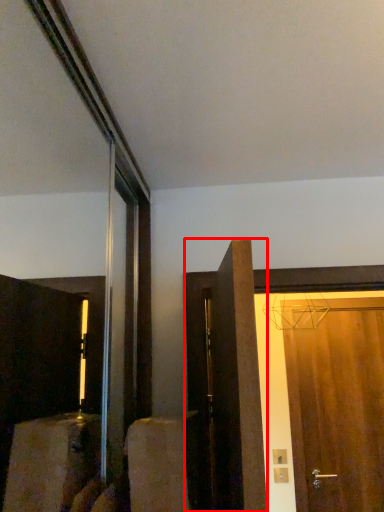
Question: From the image's perspective, what is the correct spatial positioning of door (annotated by the red box) in reference to door?

Choices:
 (A) below
 (B) above

Answer: (B)